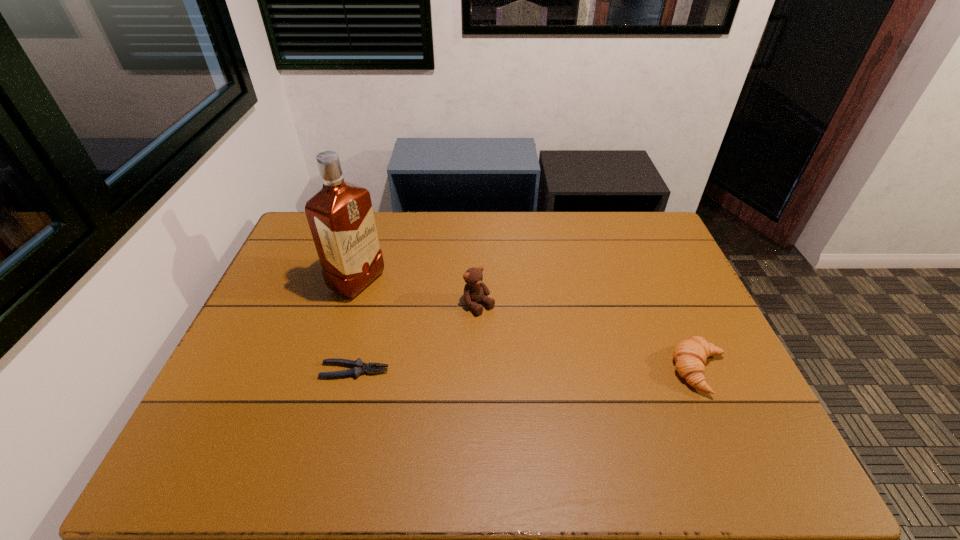
Where is `blank area located on the face of the third shortest object`? The width and height of the screenshot is (960, 540). blank area located on the face of the third shortest object is located at coordinates (504, 330).

Identify the location of vacant space located on the front label of the tallest object. (407, 306).

I want to click on free space located on the front label of the tallest object, so [452, 326].

Where is `vacant space located 0.330m on the front label of the tallest object`? This screenshot has width=960, height=540. vacant space located 0.330m on the front label of the tallest object is located at coordinates (470, 334).

The height and width of the screenshot is (540, 960). Identify the location of object positioned at the near edge. (690, 355).

Locate an element on the screen. object situated at the right edge is located at coordinates (690, 355).

Find the location of a particular element. object located at the near right corner is located at coordinates (690, 355).

In the image, there is a desktop. Where is `vacant area at the far edge`? vacant area at the far edge is located at coordinates (564, 244).

Where is `free point at the near edge`? The width and height of the screenshot is (960, 540). free point at the near edge is located at coordinates (279, 415).

Locate an element on the screen. Image resolution: width=960 pixels, height=540 pixels. vacant region at the left edge is located at coordinates (257, 309).